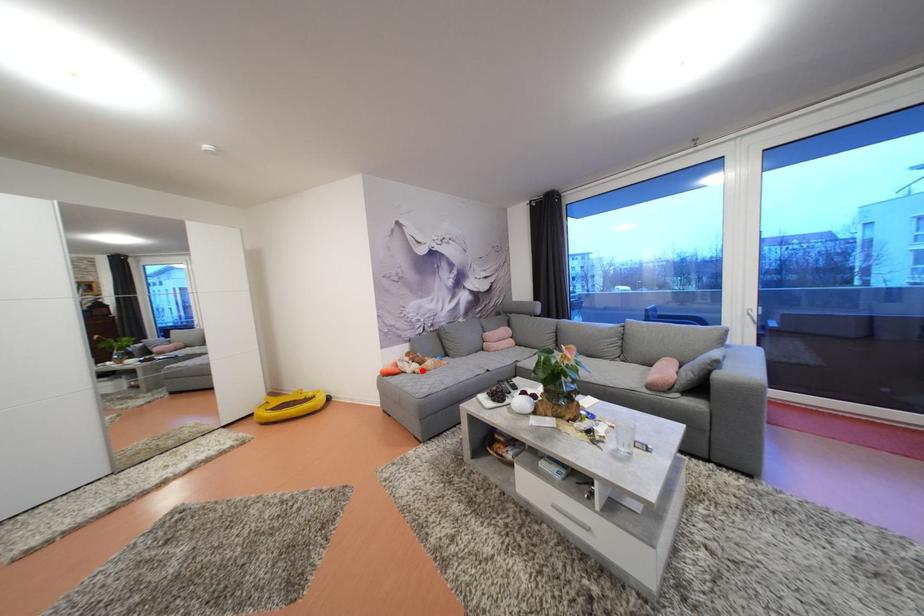
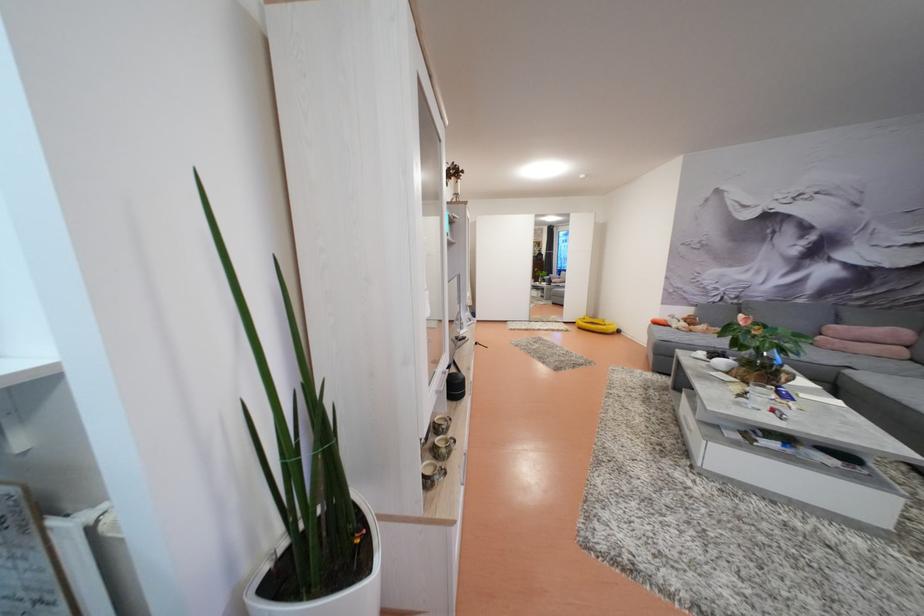
The point at the highlighted location is marked in the first image. Where is the corresponding point in the second image?

(689, 330)